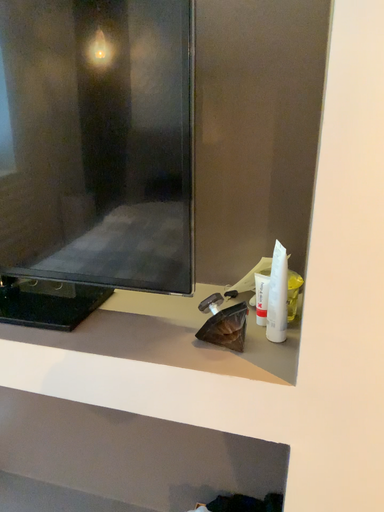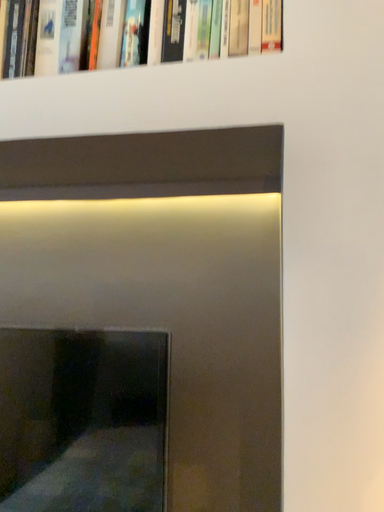
Question: How did the camera likely rotate when shooting the video?

Choices:
 (A) rotated downward
 (B) rotated upward

Answer: (B)